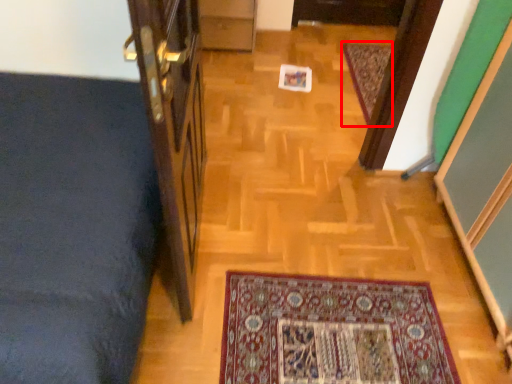
Question: From the image's perspective, what is the correct spatial relationship of mat (annotated by the red box) in relation to door?

Choices:
 (A) above
 (B) below

Answer: (A)